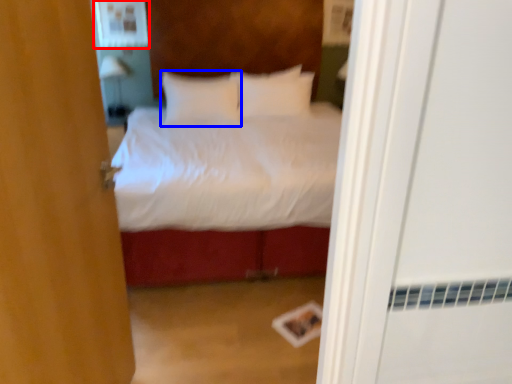
Question: Among these objects, which one is nearest to the camera, medicine cabinet (highlighted by a red box) or pillow (highlighted by a blue box)?

Choices:
 (A) medicine cabinet
 (B) pillow

Answer: (B)